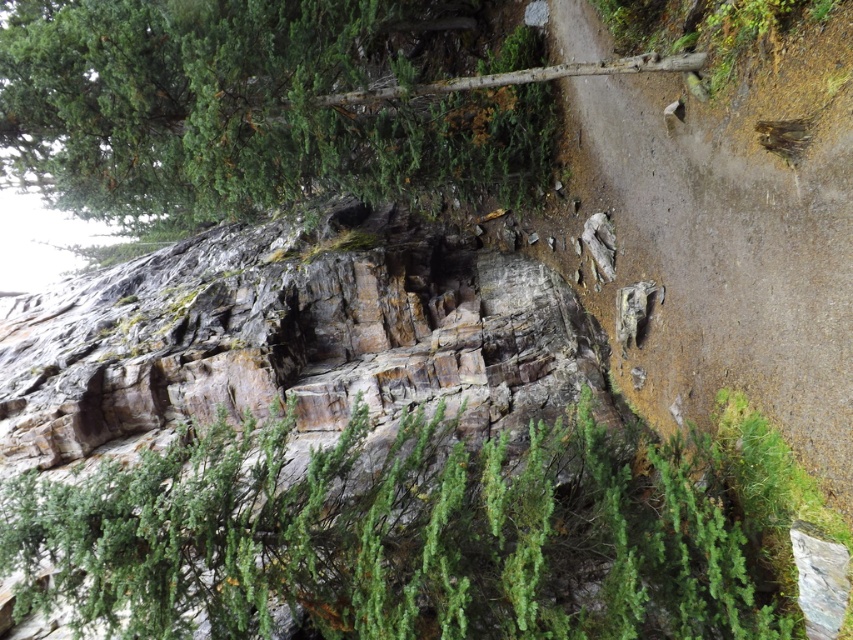
Question: Which object appears farthest from the camera in this image?

Choices:
 (A) green textured tree at upper left
 (B) dirt/gravel mountain path at center

Answer: (A)

Question: Is green textured tree at upper left below dirt/gravel mountain path at center?

Choices:
 (A) yes
 (B) no

Answer: (B)

Question: Does green textured tree at upper left appear on the left side of dirt/gravel mountain path at center?

Choices:
 (A) yes
 (B) no

Answer: (A)

Question: Which object appears farthest from the camera in this image?

Choices:
 (A) dirt/gravel mountain path at center
 (B) green textured tree at upper left

Answer: (B)

Question: Among these points, which one is nearest to the camera?

Choices:
 (A) (202, 179)
 (B) (715, 342)

Answer: (B)

Question: Can you confirm if green textured tree at upper left is positioned to the right of dirt/gravel mountain path at center?

Choices:
 (A) no
 (B) yes

Answer: (A)